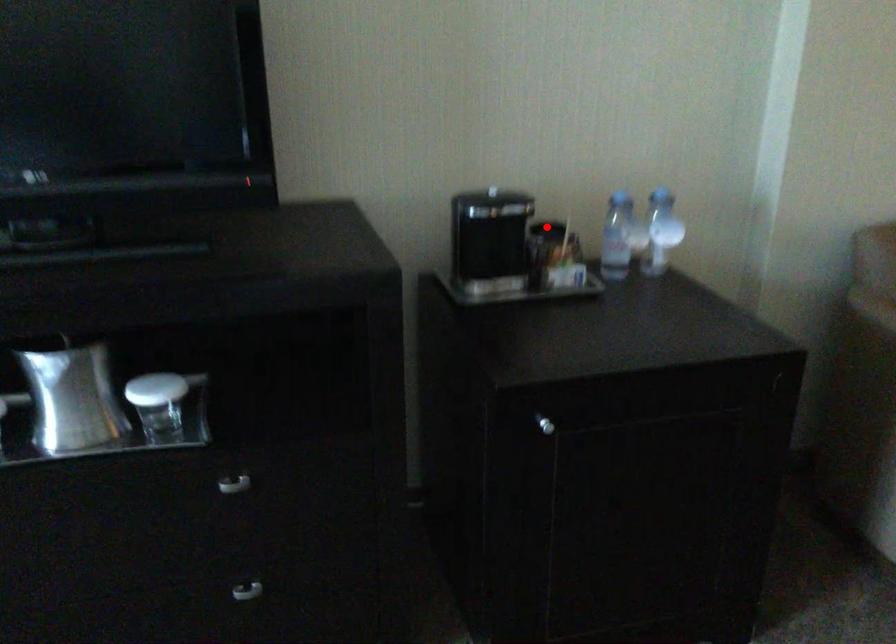
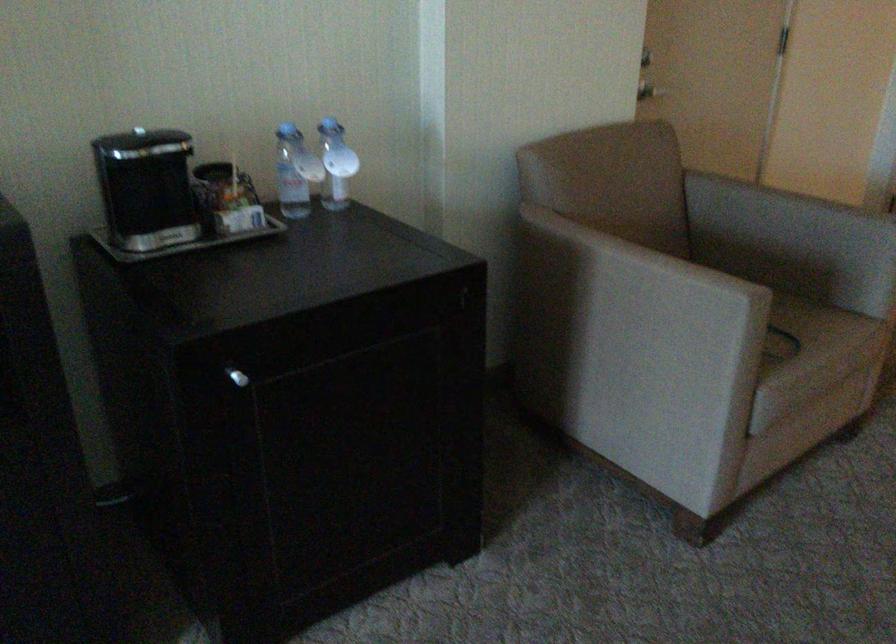
Question: I am providing you with two images of the same scene from different viewpoints. In image1, a red point is highlighted. Considering the same 3D point in image2, which of the following is correct?

Choices:
 (A) It is closer
 (B) It is farther

Answer: (A)